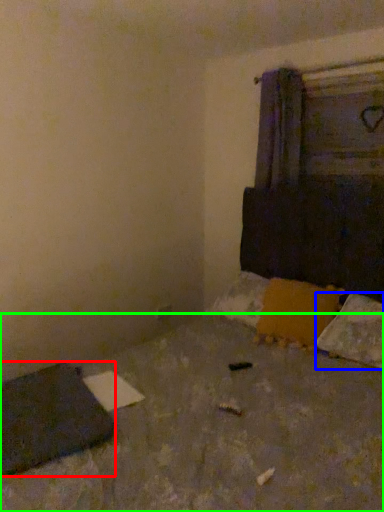
Question: Which is nearer to the pad (highlighted by a red box)? pillow (highlighted by a blue box) or concrete (highlighted by a green box).

Choices:
 (A) pillow
 (B) concrete

Answer: (B)